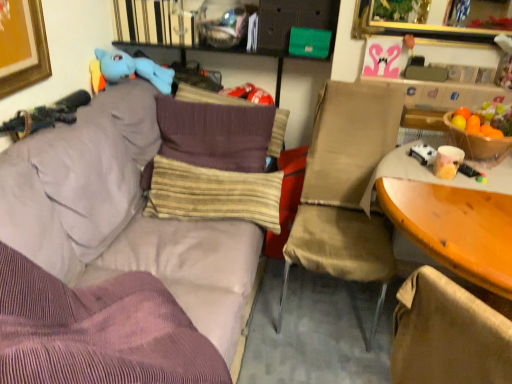
Question: Should I look upward or downward to see striped fabric pillow at center, which is the 1th pillow in front-to-back order?

Choices:
 (A) down
 (B) up

Answer: (A)

Question: Does striped fabric pillow at center, the first pillow from the bottom, have a lesser width compared to blue plush toy at upper left?

Choices:
 (A) yes
 (B) no

Answer: (A)

Question: Does striped fabric pillow at center, acting as the 2th pillow starting from the back, turn towards blue plush toy at upper left?

Choices:
 (A) yes
 (B) no

Answer: (B)

Question: Is striped fabric pillow at center, acting as the 2th pillow starting from the back, far from blue plush toy at upper left?

Choices:
 (A) yes
 (B) no

Answer: (B)

Question: Is striped fabric pillow at center, positioned as the second pillow in top-to-bottom order, to the left of blue plush toy at upper left from the viewer's perspective?

Choices:
 (A) no
 (B) yes

Answer: (A)

Question: Are striped fabric pillow at center, the first pillow from the bottom, and blue plush toy at upper left making contact?

Choices:
 (A) yes
 (B) no

Answer: (B)

Question: Is striped fabric pillow at center, acting as the 2th pillow starting from the back, wider than blue plush toy at upper left?

Choices:
 (A) no
 (B) yes

Answer: (A)

Question: Can you see beige fabric chair at center touching striped fabric pillow at center, acting as the 2th pillow starting from the back?

Choices:
 (A) no
 (B) yes

Answer: (A)

Question: Is beige fabric chair at center at the right side of striped fabric pillow at center, the first pillow from the bottom?

Choices:
 (A) yes
 (B) no

Answer: (A)

Question: Is beige fabric chair at center smaller than striped fabric pillow at center, which is the 1th pillow in front-to-back order?

Choices:
 (A) yes
 (B) no

Answer: (B)

Question: Is beige fabric chair at center in front of striped fabric pillow at center, the first pillow from the bottom?

Choices:
 (A) yes
 (B) no

Answer: (A)

Question: Can you confirm if beige fabric chair at center is bigger than striped fabric pillow at center, which is the 1th pillow in front-to-back order?

Choices:
 (A) no
 (B) yes

Answer: (B)

Question: From a real-world perspective, is beige fabric chair at center located beneath striped fabric pillow at center, which is the 1th pillow in front-to-back order?

Choices:
 (A) yes
 (B) no

Answer: (B)

Question: From a real-world perspective, is striped fabric pillow at center, which is the 1th pillow in front-to-back order, physically above purple corduroy couch at upper left?

Choices:
 (A) no
 (B) yes

Answer: (B)